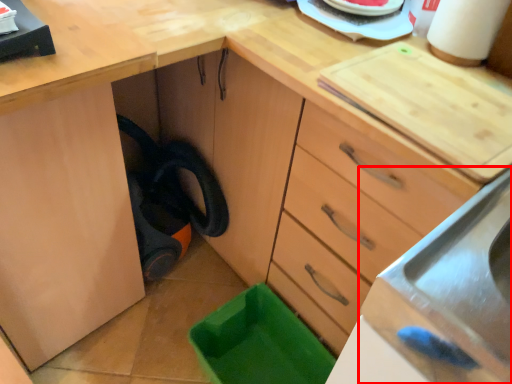
Question: Considering the relative positions of sink (annotated by the red box) and paper towel in the image provided, where is sink (annotated by the red box) located with respect to the staircase?

Choices:
 (A) left
 (B) right

Answer: (A)